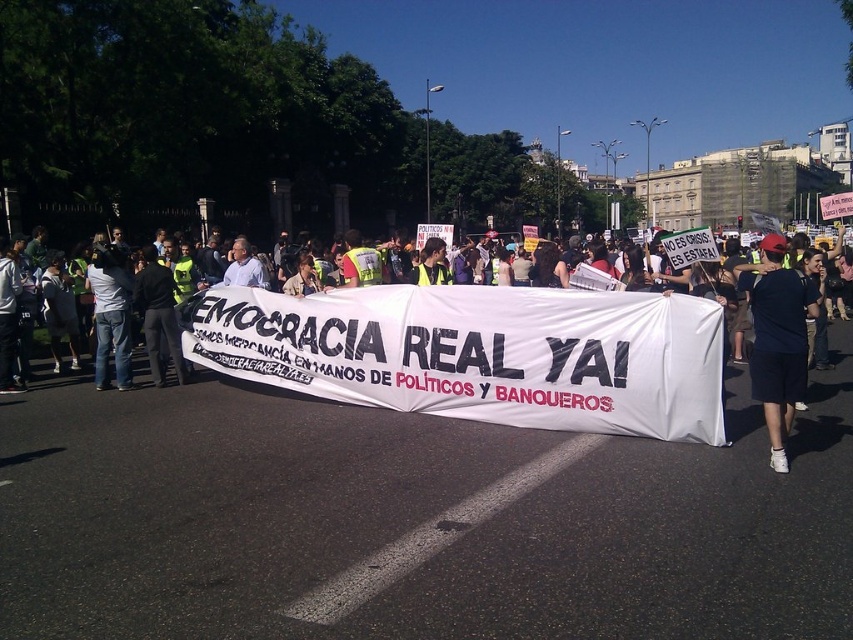
Between black fabric banner at center and black cotton t-shirt at center, which one appears on the right side from the viewer's perspective?

Positioned to the right is black cotton t-shirt at center.

Who is taller, black fabric banner at center or black cotton t-shirt at center?

With more height is black cotton t-shirt at center.

Is point (465, 339) behind point (776, 353)?

Yes, point (465, 339) is behind point (776, 353).

Identify the location of black fabric banner at center. The height and width of the screenshot is (640, 853). (480, 353).